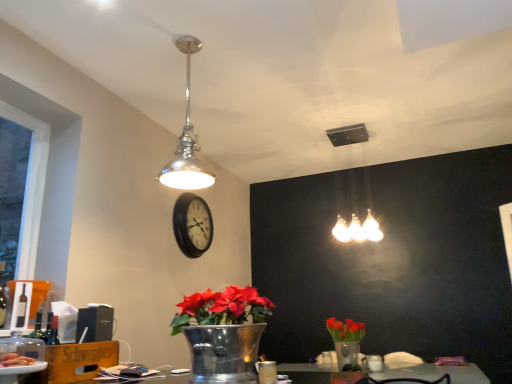
Question: Based on their sizes in the image, would you say translucent plastic plate at lower left is bigger or smaller than white frosted glass light fixture at upper center, which is counted as the second lamp, starting from the front?

Choices:
 (A) small
 (B) big

Answer: (A)

Question: In the image, is translucent plastic plate at lower left positioned in front of or behind white frosted glass light fixture at upper center, which appears as the 1th lamp when viewed from the back?

Choices:
 (A) behind
 (B) front

Answer: (B)

Question: Which of these objects is positioned farthest from the black wooden clock at center?

Choices:
 (A) metallic silver vase at lower center
 (B) white frosted glass light fixture at upper center, which appears as the 1th lamp when viewed from the back
 (C) metallic silver vase with red flowers at lower right
 (D) translucent plastic plate at lower left
 (E) polished chrome pendant light at upper center, marked as the 1th lamp in a left-to-right arrangement

Answer: (D)

Question: Based on their relative distances, which object is farther from the black wooden clock at center?

Choices:
 (A) metallic silver vase at lower center
 (B) white frosted glass light fixture at upper center, which is counted as the 2th lamp, starting from the left
 (C) translucent plastic plate at lower left
 (D) metallic silver vase with red flowers at lower right
 (E) polished chrome pendant light at upper center, the second lamp from the right

Answer: (C)